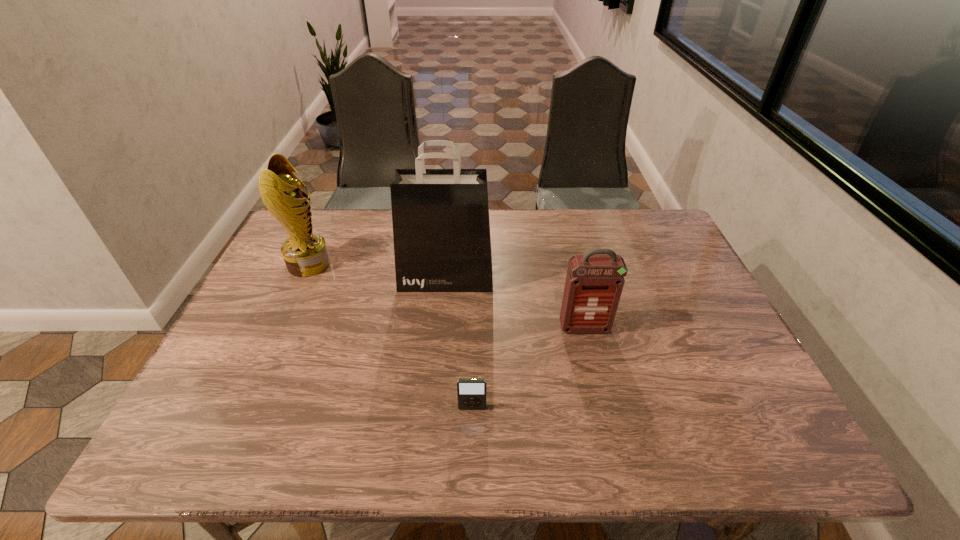
Locate an element on the screen. object that is the second closest to the tallest object is located at coordinates (305, 253).